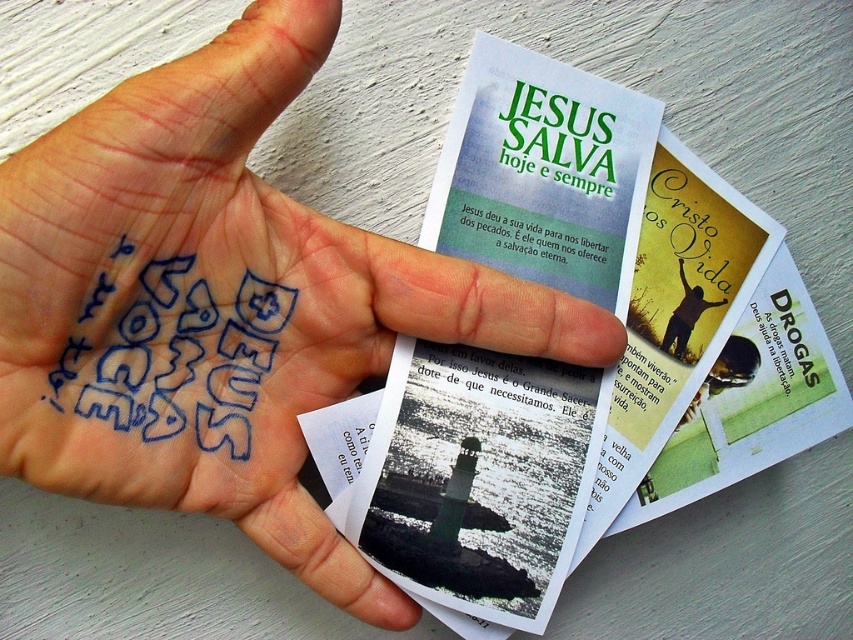
Does blue ink palm at center appear on the right side of white paper postcard at center?

In fact, blue ink palm at center is to the left of white paper postcard at center.

Measure the distance from blue ink palm at center to white paper postcard at center.

A distance of 3.47 inches exists between blue ink palm at center and white paper postcard at center.

I want to click on blue ink palm at center, so click(224, 300).

Where is `blue ink palm at center`? The width and height of the screenshot is (853, 640). blue ink palm at center is located at coordinates (224, 300).

Can you confirm if white paper postcard at center is taller than black paper text at center?

Yes.

This screenshot has width=853, height=640. Identify the location of white paper postcard at center. (479, 477).

Does white paper postcard at center have a lesser height compared to silhouette figure at center?

No.

Can you confirm if white paper postcard at center is smaller than silhouette figure at center?

Incorrect, white paper postcard at center is not smaller in size than silhouette figure at center.

Identify the location of white paper postcard at center. This screenshot has height=640, width=853. (479, 477).

I want to click on white paper postcard at center, so click(x=479, y=477).